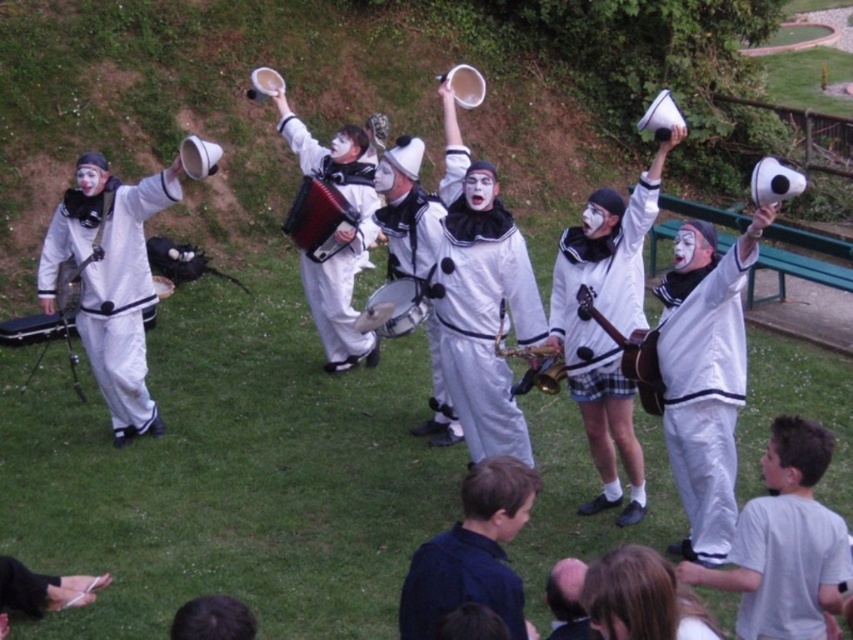
You are a photographer setting up for a performance. You need to position a camera to capture both the matte black accordion at center and the satin gold saxophone at center. If the camera can only focus on one object at a time, which object should you focus on first to ensure the wider object is in frame?

The matte black accordion at center is wider than the satin gold saxophone at center. Therefore, you should focus on the matte black accordion at center first to ensure its entire width is captured before adjusting for the saxophone.

You are a photographer trying to capture a clear shot of the white matte uniform at center and the white matte accordion at center. Since both are white, you need to adjust your camera settings to account for their positions. Which object should you focus on first to ensure proper exposure, considering their vertical arrangement?

The white matte uniform at center is positioned under the white matte accordion at center. To ensure proper exposure, focus on the white matte accordion at center first since it is higher and might be in brighter light, then adjust for the uniform below.

You are a photographer trying to capture the white matte uniform at center in your shot. The camera you are using has a focus point at coordinate point (601, 294). Will this focus point help you capture the white matte uniform at center clearly?

Yes, the point (601, 294) marks the white matte uniform at center, so using this focus point will ensure the uniform is in clear focus.